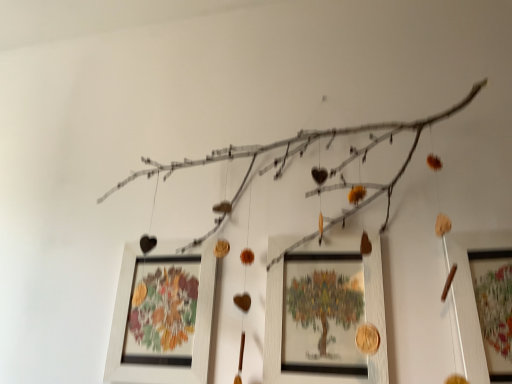
Question: Are wooden frame at center, which appears as the first picture frame when viewed from the left, and wooden picture frame at right, arranged as the third picture frame when viewed from the left, located far from each other?

Choices:
 (A) no
 (B) yes

Answer: (A)

Question: From the image's perspective, is wooden frame at center, the third picture frame positioned from the right, beneath wooden picture frame at right, which is counted as the 1th picture frame, starting from the right?

Choices:
 (A) yes
 (B) no

Answer: (A)

Question: Is wooden frame at center, the third picture frame positioned from the right, in contact with wooden picture frame at right, arranged as the third picture frame when viewed from the left?

Choices:
 (A) no
 (B) yes

Answer: (A)

Question: Is wooden frame at center, which appears as the first picture frame when viewed from the left, turned away from wooden picture frame at right, arranged as the third picture frame when viewed from the left?

Choices:
 (A) yes
 (B) no

Answer: (B)

Question: Is wooden frame at center, which appears as the first picture frame when viewed from the left, outside of wooden picture frame at right, which is counted as the 1th picture frame, starting from the right?

Choices:
 (A) no
 (B) yes

Answer: (B)

Question: From the image's perspective, is wooden frame at center, which appears as the first picture frame when viewed from the left, above or below wooden framed picture at center, the second picture frame viewed from the right?

Choices:
 (A) below
 (B) above

Answer: (A)

Question: Considering the positions of wooden frame at center, which appears as the first picture frame when viewed from the left, and wooden framed picture at center, marked as the 2th picture frame in a left-to-right arrangement, in the image, is wooden frame at center, which appears as the first picture frame when viewed from the left, wider or thinner than wooden framed picture at center, marked as the 2th picture frame in a left-to-right arrangement,?

Choices:
 (A) thin
 (B) wide

Answer: (B)

Question: Does point (142, 276) appear closer or farther from the camera than point (362, 321)?

Choices:
 (A) farther
 (B) closer

Answer: (A)

Question: Is wooden frame at center, the third picture frame positioned from the right, taller or shorter than wooden framed picture at center, the second picture frame viewed from the right?

Choices:
 (A) short
 (B) tall

Answer: (A)

Question: From the image's perspective, relative to wooden frame at center, the third picture frame positioned from the right, is wooden framed picture at center, marked as the 2th picture frame in a left-to-right arrangement, above or below?

Choices:
 (A) above
 (B) below

Answer: (A)

Question: Considering the relative positions of wooden framed picture at center, the second picture frame viewed from the right, and wooden frame at center, which appears as the first picture frame when viewed from the left, in the image provided, is wooden framed picture at center, the second picture frame viewed from the right, to the left or to the right of wooden frame at center, which appears as the first picture frame when viewed from the left,?

Choices:
 (A) left
 (B) right

Answer: (B)

Question: Looking at their shapes, would you say wooden framed picture at center, the second picture frame viewed from the right, is wider or thinner than wooden frame at center, which appears as the first picture frame when viewed from the left?

Choices:
 (A) thin
 (B) wide

Answer: (A)

Question: Is wooden framed picture at center, marked as the 2th picture frame in a left-to-right arrangement, inside the boundaries of wooden frame at center, the third picture frame positioned from the right, or outside?

Choices:
 (A) outside
 (B) inside

Answer: (A)

Question: Does point (510, 243) appear closer or farther from the camera than point (303, 254)?

Choices:
 (A) farther
 (B) closer

Answer: (B)

Question: From a real-world perspective, is wooden picture frame at right, which is counted as the 1th picture frame, starting from the right, above or below wooden framed picture at center, marked as the 2th picture frame in a left-to-right arrangement?

Choices:
 (A) below
 (B) above

Answer: (B)